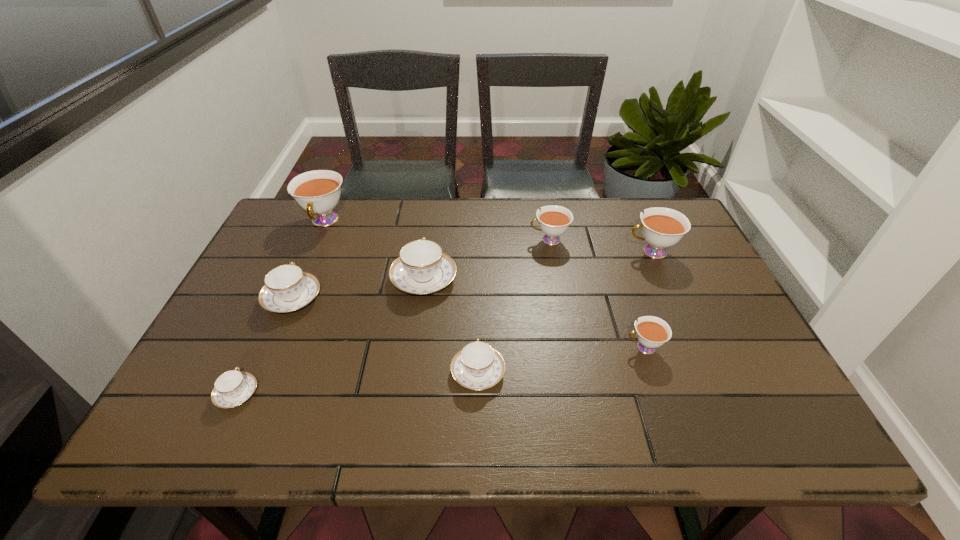
You are a GUI agent. You are given a task and a screenshot of the screen. Output one action in this format:
    pyautogui.click(x=<x>, y=<y>)
    Task: Click on the vacant position located 0.340m on the side with the handle of the second smallest blue teacup
    This screenshot has width=960, height=540.
    Given the screenshot: What is the action you would take?
    pyautogui.click(x=478, y=256)

Locate an element on the screen. This screenshot has height=540, width=960. vacant region located on the side with the handle of the shortest teacup is located at coordinates (296, 265).

The image size is (960, 540). Find the location of `free space located on the side with the handle of the shortest teacup`. free space located on the side with the handle of the shortest teacup is located at coordinates (256, 350).

Identify the location of vacant region located on the side with the handle of the shortest teacup. (284, 290).

You are a GUI agent. You are given a task and a screenshot of the screen. Output one action in this format:
    pyautogui.click(x=<x>, y=<y>)
    Task: Click on the object located in the near edge section of the desktop
    The width and height of the screenshot is (960, 540).
    Given the screenshot: What is the action you would take?
    pyautogui.click(x=232, y=388)

This screenshot has height=540, width=960. Identify the location of object that is at the right edge. (662, 227).

I want to click on object present at the far left corner, so click(318, 192).

Locate an element on the screen. The height and width of the screenshot is (540, 960). object situated at the near left corner is located at coordinates (232, 388).

Where is `object that is at the far right corner`? object that is at the far right corner is located at coordinates (662, 227).

What are the coordinates of `vacant space at the far edge of the desktop` in the screenshot? It's located at (594, 217).